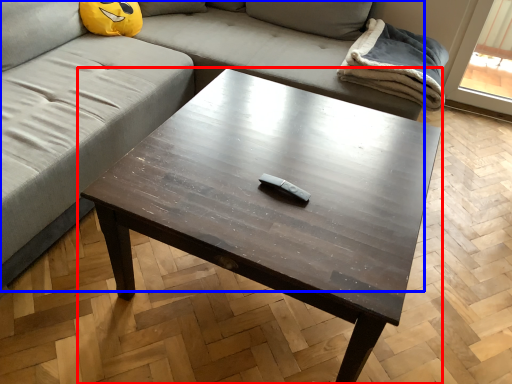
Question: Which point is further to the camera, coffee table (highlighted by a red box) or studio couch (highlighted by a blue box)?

Choices:
 (A) coffee table
 (B) studio couch

Answer: (A)